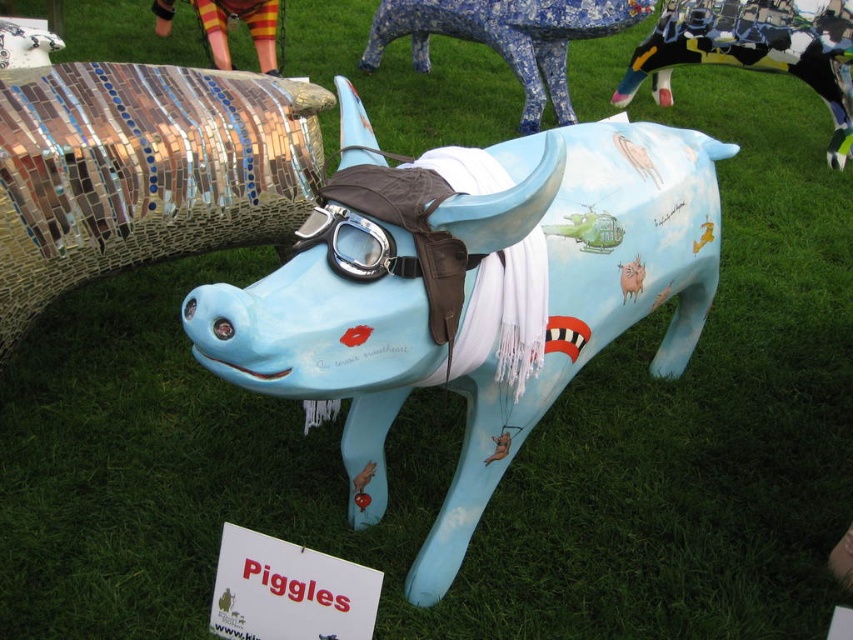
You are a photographer standing in the grassy area and want to take a photo of the black and white mosaic cow at upper right and the blue mosaic cow at upper center. Which cow will appear larger in the photo?

The black and white mosaic cow at upper right will appear larger in the photo because it is closer to the photographer than the blue mosaic cow at upper center.

You are a photographer standing at the center of the grassy area. You want to take a photo of the black and white mosaic cow at upper right. Based on its 2D location coordinates, where should you position your camera to capture it in the frame?

The black and white mosaic cow at upper right is located at coordinates point (x=753, y=51), so you should position your camera to the upper right side of the grassy area to capture it in the frame.

You are standing at the center of the grassy area and see the black and white mosaic cow at upper right and the clear plastic goggles at center. If you want to reach both objects, which one would you need to walk towards first?

You should walk towards the clear plastic goggles at center first because it is closer to you than the black and white mosaic cow at upper right, which is 13.99 feet away.